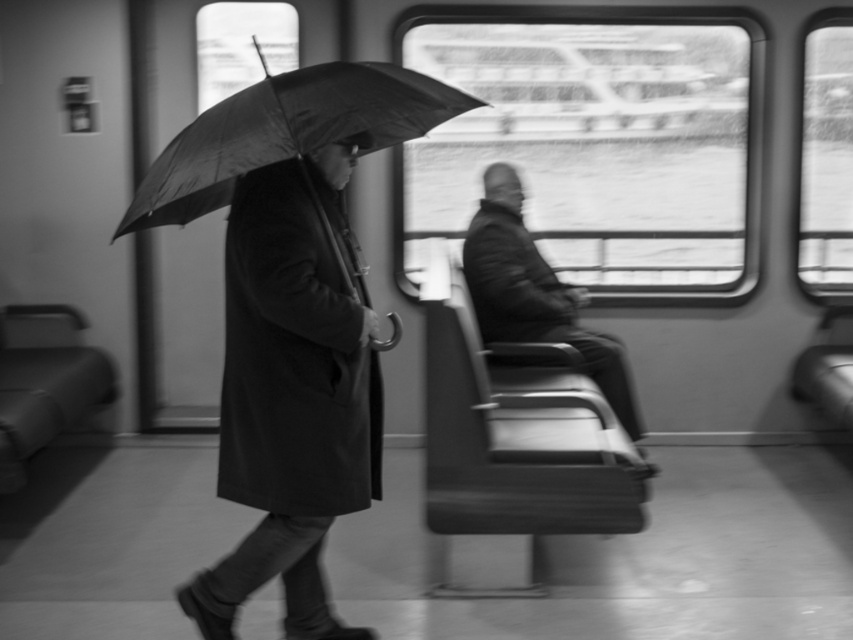
In the scene of a train car with a person walking with a matte black umbrella at left and another person seated on a bench facing away, where is the point located at coordinates [292,392]?

The point at coordinates [292,392] is on the matte black umbrella at left.

You are standing in the subway car and notice two umbrellas. Which one is positioned to the right between the matte black umbrella at left and the black matte umbrella at left?

The matte black umbrella at left is positioned to the right of the black matte umbrella at left.